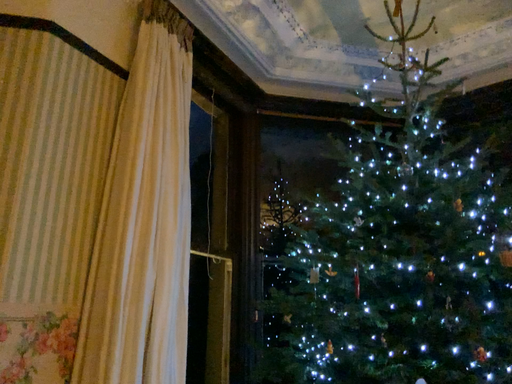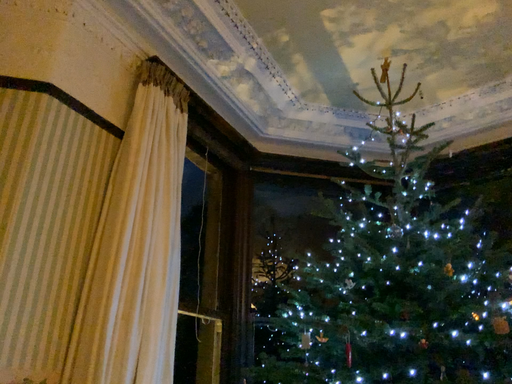
Question: Which way did the camera rotate in the video?

Choices:
 (A) rotated downward
 (B) rotated upward

Answer: (B)